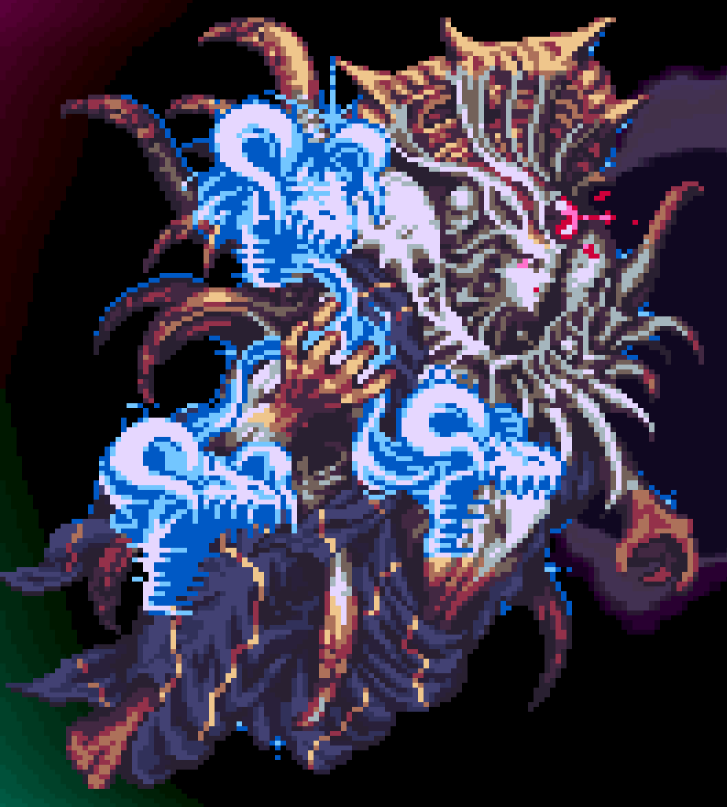
Identify the location of console. This screenshot has height=807, width=727. (517, 624).